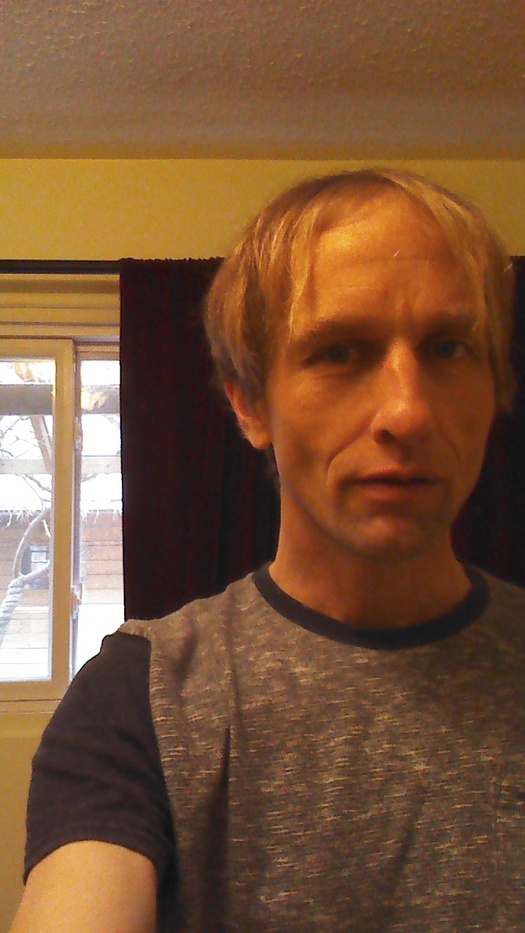
Locate an element on the screen. This screenshot has width=525, height=933. window is located at coordinates (28, 469), (92, 486).